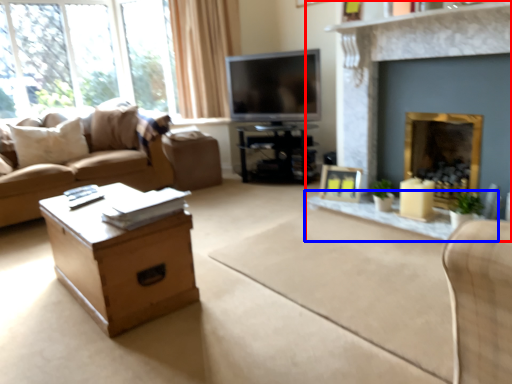
Question: Which object is closer to the camera taking this photo, fireplace (highlighted by a red box) or glass table (highlighted by a blue box)?

Choices:
 (A) fireplace
 (B) glass table

Answer: (A)